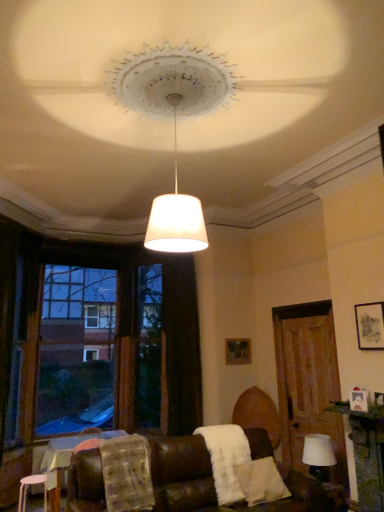
Question: Is wooden picture frame at center, marked as the 2th picture frame in a right-to-left arrangement, positioned with its back to brown leather couch at lower center?

Choices:
 (A) yes
 (B) no

Answer: (B)

Question: Is wooden picture frame at center, placed as the 1th picture frame when sorted from bottom to top, in front of brown leather couch at lower center?

Choices:
 (A) yes
 (B) no

Answer: (B)

Question: Can you confirm if wooden picture frame at center, which appears as the first picture frame when viewed from the back, is thinner than brown leather couch at lower center?

Choices:
 (A) no
 (B) yes

Answer: (B)

Question: Is wooden picture frame at center, acting as the second picture frame starting from the top, positioned behind brown leather couch at lower center?

Choices:
 (A) yes
 (B) no

Answer: (A)

Question: Can you confirm if wooden picture frame at center, marked as the 2th picture frame in a right-to-left arrangement, is taller than brown leather couch at lower center?

Choices:
 (A) no
 (B) yes

Answer: (A)

Question: Is brown leather couch at lower center surrounded by wooden picture frame at center, placed as the 1th picture frame when sorted from bottom to top?

Choices:
 (A) yes
 (B) no

Answer: (B)

Question: Does white fluffy blanket at lower center, which is the 2th blanket from left to right, have a larger size compared to white matte lampshade at center?

Choices:
 (A) no
 (B) yes

Answer: (A)

Question: Considering the relative sizes of white fluffy blanket at lower center, acting as the 1th blanket starting from the right, and white matte lampshade at center in the image provided, is white fluffy blanket at lower center, acting as the 1th blanket starting from the right, thinner than white matte lampshade at center?

Choices:
 (A) no
 (B) yes

Answer: (B)

Question: Does white fluffy blanket at lower center, acting as the 1th blanket starting from the right, have a smaller size compared to white matte lampshade at center?

Choices:
 (A) yes
 (B) no

Answer: (A)

Question: Is there a large distance between white fluffy blanket at lower center, which is the 2th blanket from left to right, and white matte lampshade at center?

Choices:
 (A) yes
 (B) no

Answer: (A)

Question: From the image's perspective, is white fluffy blanket at lower center, which is the 2th blanket from left to right, above white matte lampshade at center?

Choices:
 (A) no
 (B) yes

Answer: (A)

Question: Does white fluffy blanket at lower center, acting as the 1th blanket starting from the right, have a greater width compared to white matte lampshade at center?

Choices:
 (A) no
 (B) yes

Answer: (A)

Question: Can you confirm if white matte stool at lower left is wider than matte black picture frame at upper right, which is the second picture frame in bottom-to-top order?

Choices:
 (A) no
 (B) yes

Answer: (B)